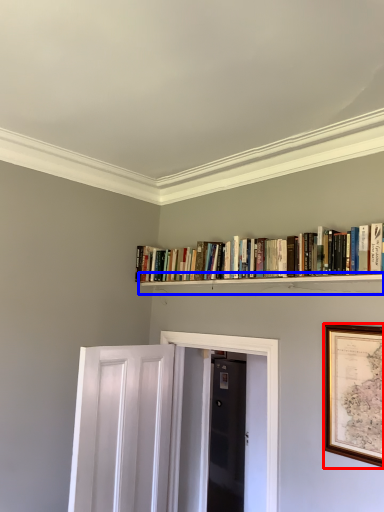
Question: Which of the following is the closest to the observer, picture frame (highlighted by a red box) or shelf (highlighted by a blue box)?

Choices:
 (A) picture frame
 (B) shelf

Answer: (A)